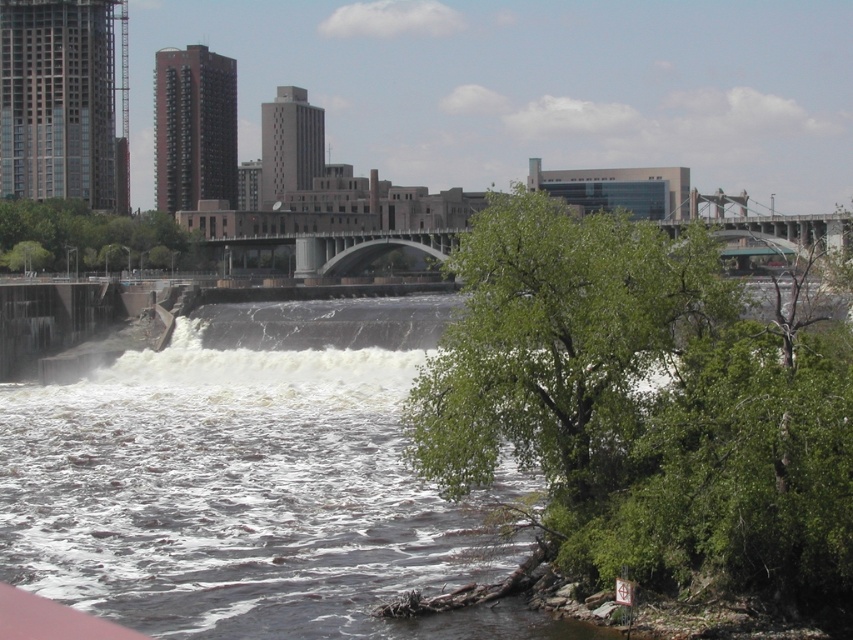
Based on the photo, you are a city planner assessing the urban riverscape. You notice two green leafy trees in the scene. Which tree has a smaller width, the green leafy tree at lower right or the green leafy tree at upper center?

The green leafy tree at lower right has a smaller width compared to the green leafy tree at upper center.

You are a drone operator trying to capture a video of the white frothy water at center. Your drone has a maximum flight range of 50 meters. Can you safely capture the video without exceeding the drone range limit?

The white frothy water at center is 56.05 meters away, which exceeds the drone range limit of 50 meters. Therefore, you cannot safely capture the video without exceeding the drone range limit.